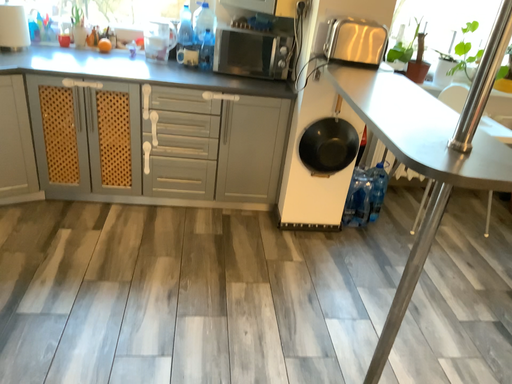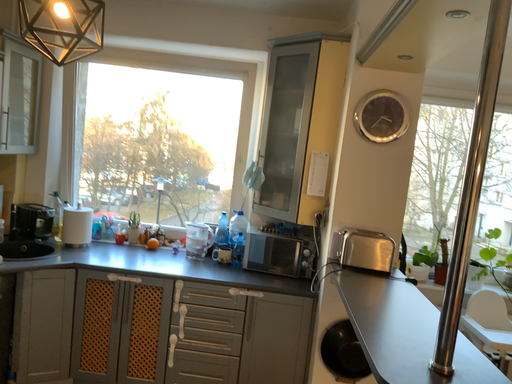
Question: How did the camera likely rotate when shooting the video?

Choices:
 (A) rotated left
 (B) rotated right

Answer: (A)